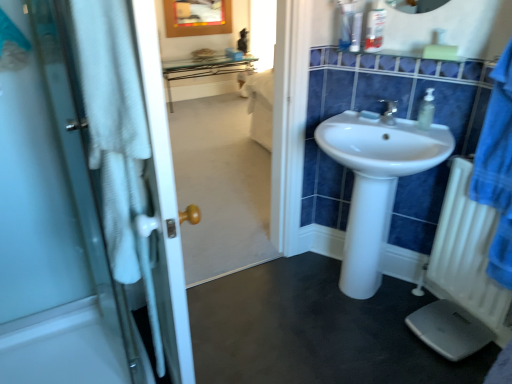
What do you see at coordinates (370, 115) in the screenshot? I see `white matte soap at center` at bounding box center [370, 115].

Locate an element on the screen. This screenshot has height=384, width=512. white plastic scale at lower right is located at coordinates (449, 329).

Locate an element on the screen. translucent plastic bottle at upper right, which appears as the first toiletry when viewed from the right is located at coordinates [x=375, y=28].

The width and height of the screenshot is (512, 384). In order to click on translucent plastic soap dispenser at upper right in this screenshot , I will do `click(426, 111)`.

From the picture: From a real-world perspective, who is located higher, black rubber mat at lower center or clear plastic cup at upper center, marked as the second toiletry in a left-to-right arrangement?

From a 3D spatial view, clear plastic cup at upper center, marked as the second toiletry in a left-to-right arrangement, is above.

Does black rubber mat at lower center contain clear plastic cup at upper center, which is counted as the second toiletry, starting from the right?

No, clear plastic cup at upper center, which is counted as the second toiletry, starting from the right, is not surrounded by black rubber mat at lower center.

Can you tell me how much black rubber mat at lower center and clear plastic cup at upper center, which is counted as the second toiletry, starting from the right, differ in facing direction?

The angular difference between black rubber mat at lower center and clear plastic cup at upper center, which is counted as the second toiletry, starting from the right, is 176 degrees.

Is black rubber mat at lower center closer to the viewer compared to clear plastic cup at upper center, marked as the second toiletry in a left-to-right arrangement?

Yes, black rubber mat at lower center is closer to the viewer.

Is clear plastic cup at upper center, marked as the second toiletry in a left-to-right arrangement, to the left of black rubber mat at lower center from the viewer's perspective?

Incorrect, clear plastic cup at upper center, marked as the second toiletry in a left-to-right arrangement, is not on the left side of black rubber mat at lower center.

Is black rubber mat at lower center at the back of clear plastic cup at upper center, which is counted as the second toiletry, starting from the right?

clear plastic cup at upper center, which is counted as the second toiletry, starting from the right, does not have its back to black rubber mat at lower center.

Is clear plastic cup at upper center, which is counted as the second toiletry, starting from the right, positioned in front of black rubber mat at lower center?

No, clear plastic cup at upper center, which is counted as the second toiletry, starting from the right, is further to the viewer.

Are clear plastic cup at upper center, marked as the second toiletry in a left-to-right arrangement, and black rubber mat at lower center far apart?

Absolutely, clear plastic cup at upper center, marked as the second toiletry in a left-to-right arrangement, is distant from black rubber mat at lower center.

From a real-world perspective, between clear plastic cup at upper center, marked as the second toiletry in a left-to-right arrangement, and white matte soap at center, who is vertically higher?

From a 3D spatial view, clear plastic cup at upper center, marked as the second toiletry in a left-to-right arrangement, is above.

Between point (357, 28) and point (361, 115), which one is positioned behind?

Positioned behind is point (361, 115).

Is clear plastic cup at upper center, which is counted as the second toiletry, starting from the right, positioned before white matte soap at center?

That is True.

The height and width of the screenshot is (384, 512). In order to click on soap below the clear plastic cup at upper center, marked as the second toiletry in a left-to-right arrangement (from a real-world perspective) in this screenshot , I will do `click(370, 115)`.

Can you tell me how much translucent plastic soap dispenser at upper right and white glossy sink at center differ in facing direction?

translucent plastic soap dispenser at upper right and white glossy sink at center are facing 0.000272 degrees away from each other.

Between point (428, 114) and point (361, 170), which one is positioned behind?

Point (428, 114)

Looking at this image, is translucent plastic soap dispenser at upper right not close to white glossy sink at center?

That's not correct — translucent plastic soap dispenser at upper right is a little close to white glossy sink at center.

Is translucent plastic soap dispenser at upper right completely or partially outside of white glossy sink at center?

No, translucent plastic soap dispenser at upper right is inside or overlapping with white glossy sink at center.

Which is more to the left, white glossy sink at center or clear plastic cup at upper center, which is counted as the second toiletry, starting from the right?

From the viewer's perspective, clear plastic cup at upper center, which is counted as the second toiletry, starting from the right, appears more on the left side.

Based on the photo, considering the sizes of white glossy sink at center and clear plastic cup at upper center, marked as the second toiletry in a left-to-right arrangement, in the image, is white glossy sink at center bigger or smaller than clear plastic cup at upper center, marked as the second toiletry in a left-to-right arrangement,?

Considering their sizes, white glossy sink at center takes up more space than clear plastic cup at upper center, marked as the second toiletry in a left-to-right arrangement.

Is white glossy sink at center next to clear plastic cup at upper center, which is counted as the second toiletry, starting from the right?

white glossy sink at center and clear plastic cup at upper center, which is counted as the second toiletry, starting from the right, are not in contact.

Is white glossy sink at center looking in the opposite direction of clear plastic cup at upper center, which is counted as the second toiletry, starting from the right?

No.

How many degrees apart are the facing directions of clear plastic cup at upper center, marked as the second toiletry in a left-to-right arrangement, and white plastic scale at lower right?

clear plastic cup at upper center, marked as the second toiletry in a left-to-right arrangement, and white plastic scale at lower right are facing 92.7 degrees away from each other.

Is clear plastic cup at upper center, which is counted as the second toiletry, starting from the right, positioned beyond the bounds of white plastic scale at lower right?

Yes.

Does point (352, 39) come behind point (419, 320)?

No, it is not.

Is clear plastic cup at upper center, marked as the second toiletry in a left-to-right arrangement, positioned with its back to white plastic scale at lower right?

That's not correct — clear plastic cup at upper center, marked as the second toiletry in a left-to-right arrangement, is not looking away from white plastic scale at lower right.

What's the angular difference between white glossy sink at center and white plastic radiator at lower right's facing directions?

The facing directions of white glossy sink at center and white plastic radiator at lower right are 33.1 degrees apart.

Is point (367, 285) in front of point (487, 297)?

That is False.

From a real-world perspective, which is physically above, white glossy sink at center or white plastic radiator at lower right?

white glossy sink at center is physically above.

Considering the sizes of white glossy sink at center and white plastic radiator at lower right in the image, is white glossy sink at center wider or thinner than white plastic radiator at lower right?

In the image, white glossy sink at center appears to be wider than white plastic radiator at lower right.

Locate an element on the screen. The width and height of the screenshot is (512, 384). plain directly beneath the clear plastic cup at upper center, marked as the second toiletry in a left-to-right arrangement (from a real-world perspective) is located at coordinates (315, 330).

In order to click on plain below the clear plastic cup at upper center, which is counted as the second toiletry, starting from the right (from the image's perspective) in this screenshot , I will do `click(315, 330)`.

Which object lies nearer to the anchor point black rubber mat at lower center, white plastic radiator at lower right or white plastic scale at lower right?

white plastic scale at lower right lies closer to black rubber mat at lower center than the other object.

Based on their spatial positions, is white plastic scale at lower right or white plastic radiator at lower right closer to transparent plastic cup at upper center, which is the third toiletry from right to left?

white plastic radiator at lower right is closer to transparent plastic cup at upper center, which is the third toiletry from right to left.

Looking at the image, which one is located further to white matte soap at center, white plastic scale at lower right or clear plastic cup at upper center, marked as the second toiletry in a left-to-right arrangement?

white plastic scale at lower right is further to white matte soap at center.

Based on their spatial positions, is black rubber mat at lower center or white plastic scale at lower right closer to white matte soap at center?

white plastic scale at lower right lies closer to white matte soap at center than the other object.

Considering their positions, is white glass door at left positioned further to clear plastic cup at upper center, marked as the second toiletry in a left-to-right arrangement, than translucent plastic bottle at upper right, which appears as the first toiletry when viewed from the right?

white glass door at left.

Considering their positions, is white plastic scale at lower right positioned closer to white glass door at left than white plastic radiator at lower right?

The object closer to white glass door at left is white plastic scale at lower right.

Estimate the real-world distances between objects in this image. Which object is closer to black rubber mat at lower center, clear plastic cup at upper center, marked as the second toiletry in a left-to-right arrangement, or transparent plastic cup at upper center, which is the third toiletry from right to left?

clear plastic cup at upper center, marked as the second toiletry in a left-to-right arrangement.

Looking at the image, which one is located further to white matte soap at center, translucent plastic bottle at upper right, which appears as the first toiletry when viewed from the right, or white plastic scale at lower right?

Based on the image, white plastic scale at lower right appears to be further to white matte soap at center.

Locate an element on the screen. sink that lies between clear plastic cup at upper center, marked as the second toiletry in a left-to-right arrangement, and white plastic radiator at lower right from top to bottom is located at coordinates (376, 182).

Where is `soap dispenser between clear plastic cup at upper center, marked as the second toiletry in a left-to-right arrangement, and white matte soap at center in the up-down direction`? soap dispenser between clear plastic cup at upper center, marked as the second toiletry in a left-to-right arrangement, and white matte soap at center in the up-down direction is located at coordinates (426, 111).

This screenshot has width=512, height=384. I want to click on plain situated between white glass door at left and translucent plastic soap dispenser at upper right from left to right, so click(x=315, y=330).

At what (x,y) coordinates should I click in order to perform the action: click on door between translucent plastic bottle at upper right, which appears as the first toiletry when viewed from the right, and black rubber mat at lower center in the up-down direction. Please return your answer as a coordinate pair (x, y). The image size is (512, 384). Looking at the image, I should click on (51, 223).